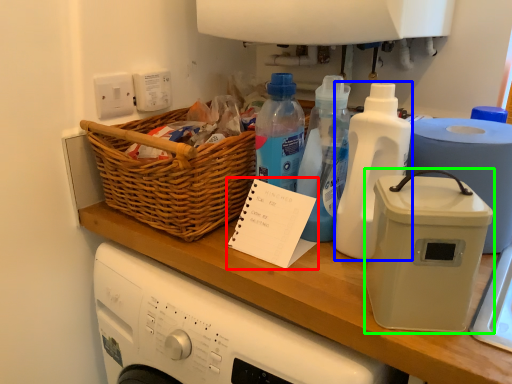
Question: Which object is positioned closest to notepad (highlighted by a red box)? Select from bottle (highlighted by a blue box) and kitchen appliance (highlighted by a green box).

Choices:
 (A) bottle
 (B) kitchen appliance

Answer: (A)